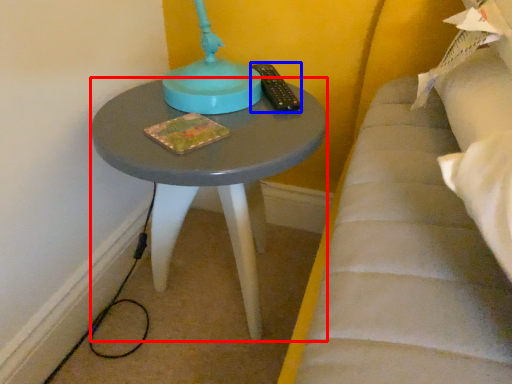
Question: Which point is further to the camera, table (highlighted by a red box) or remote (highlighted by a blue box)?

Choices:
 (A) table
 (B) remote

Answer: (B)